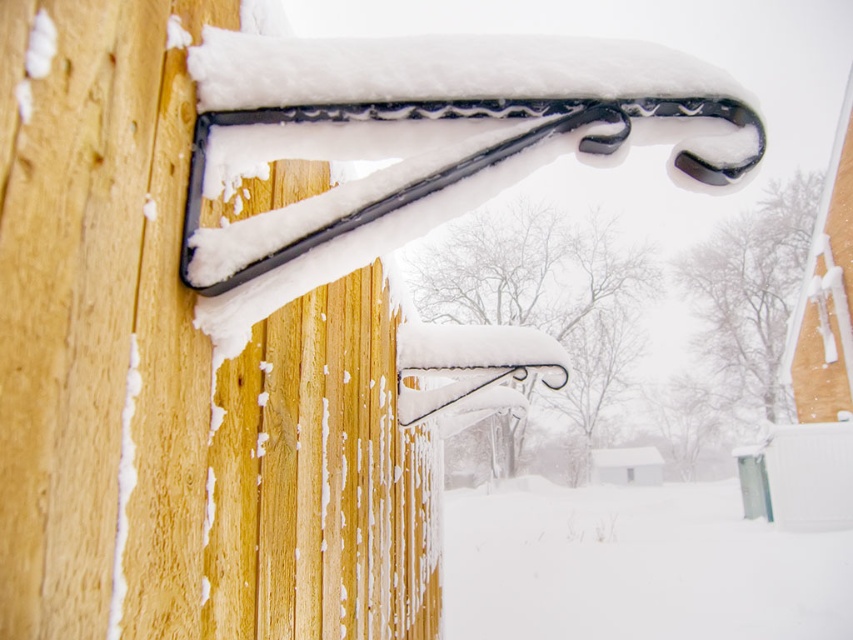
Can you confirm if wooden fence at left is bigger than white fluffy snow at lower center?

Actually, wooden fence at left might be smaller than white fluffy snow at lower center.

The image size is (853, 640). Identify the location of wooden fence at left. (178, 381).